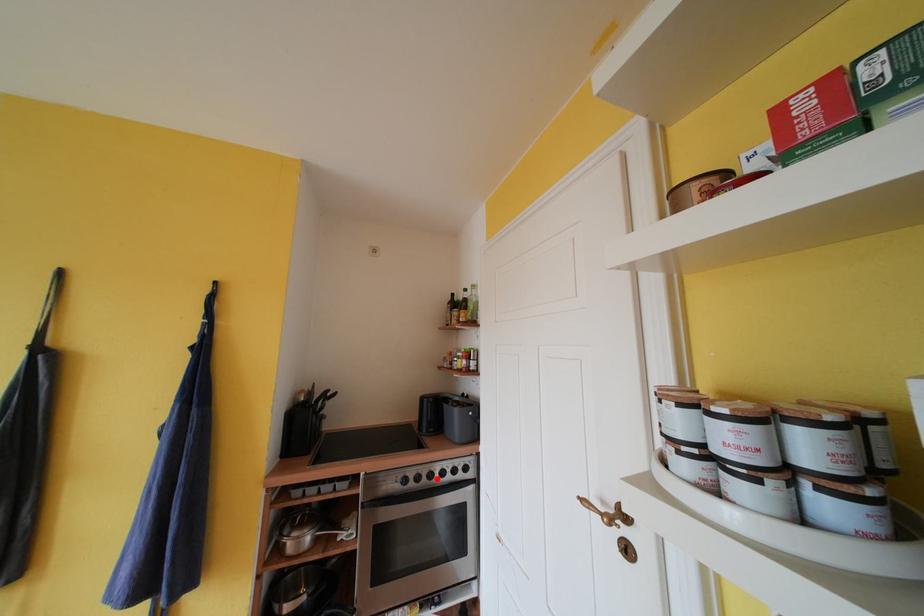
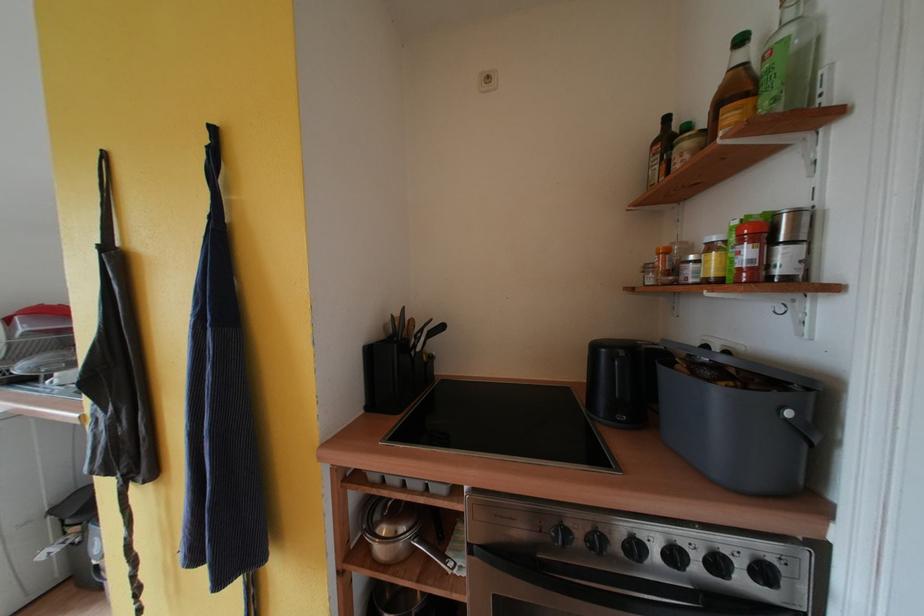
The point at the highlighted location is marked in the first image. Where is the corresponding point in the second image?

(641, 551)